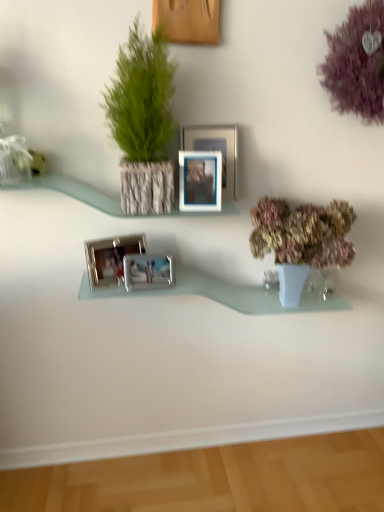
Question: Can you confirm if green textured plant at upper left, which is the first houseplant in top-to-bottom order, is shorter than silver metallic photo frame at center, which ranks as the 2th picture frame in bottom-to-top order?

Choices:
 (A) no
 (B) yes

Answer: (A)

Question: Is green textured plant at upper left, which is the first houseplant in top-to-bottom order, not inside silver metallic photo frame at center, which ranks as the 2th picture frame in bottom-to-top order?

Choices:
 (A) no
 (B) yes

Answer: (B)

Question: From a real-world perspective, is green textured plant at upper left, arranged as the second houseplant when ordered from the bottom, positioned over silver metallic photo frame at center, which ranks as the 4th picture frame in top-to-bottom order, based on gravity?

Choices:
 (A) yes
 (B) no

Answer: (A)

Question: Can you confirm if green textured plant at upper left, placed as the 2th houseplant when sorted from right to left, is positioned to the right of silver metallic photo frame at center, which ranks as the 2th picture frame in bottom-to-top order?

Choices:
 (A) yes
 (B) no

Answer: (A)

Question: From the image's perspective, does green textured plant at upper left, placed as the 2th houseplant when sorted from right to left, appear higher than silver metallic photo frame at center, which ranks as the 2th picture frame in bottom-to-top order?

Choices:
 (A) yes
 (B) no

Answer: (A)

Question: Considering the positions of point (183, 12) and point (302, 241), is point (183, 12) closer or farther from the camera than point (302, 241)?

Choices:
 (A) farther
 (B) closer

Answer: (B)

Question: From their relative heights in the image, would you say wooden picture frame at upper center, which is the first picture frame in top-to-bottom order, is taller or shorter than pastel pink floral arrangement at right, which is counted as the 2th houseplant, starting from the top?

Choices:
 (A) tall
 (B) short

Answer: (B)

Question: From the image's perspective, relative to pastel pink floral arrangement at right, the 2th houseplant from the left, is wooden picture frame at upper center, which is the first picture frame in top-to-bottom order, above or below?

Choices:
 (A) above
 (B) below

Answer: (A)

Question: Looking at their shapes, would you say wooden picture frame at upper center, placed as the 5th picture frame when sorted from bottom to top, is wider or thinner than pastel pink floral arrangement at right, the first houseplant when ordered from right to left?

Choices:
 (A) wide
 (B) thin

Answer: (B)

Question: Considering the relative positions of wooden picture frame at upper center, placed as the 5th picture frame when sorted from bottom to top, and silver metallic picture frame at upper center, the fourth picture frame when ordered from bottom to top, in the image provided, is wooden picture frame at upper center, placed as the 5th picture frame when sorted from bottom to top, to the left or to the right of silver metallic picture frame at upper center, the fourth picture frame when ordered from bottom to top,?

Choices:
 (A) left
 (B) right

Answer: (A)

Question: Based on their sizes in the image, would you say wooden picture frame at upper center, placed as the 5th picture frame when sorted from bottom to top, is bigger or smaller than silver metallic picture frame at upper center, the second picture frame positioned from the top?

Choices:
 (A) big
 (B) small

Answer: (B)

Question: Do you think wooden picture frame at upper center, placed as the 5th picture frame when sorted from bottom to top, is within silver metallic picture frame at upper center, the fourth picture frame when ordered from bottom to top, or outside of it?

Choices:
 (A) inside
 (B) outside

Answer: (B)

Question: From a real-world perspective, is wooden picture frame at upper center, which is the first picture frame in top-to-bottom order, positioned above or below silver metallic picture frame at upper center, the second picture frame positioned from the top?

Choices:
 (A) below
 (B) above

Answer: (B)

Question: Is green textured plant at upper left, arranged as the second houseplant when ordered from the bottom, spatially inside clear glass vase at lower right, or outside of it?

Choices:
 (A) outside
 (B) inside

Answer: (A)

Question: Considering the positions of point (140, 113) and point (307, 286), is point (140, 113) closer or farther from the camera than point (307, 286)?

Choices:
 (A) closer
 (B) farther

Answer: (A)